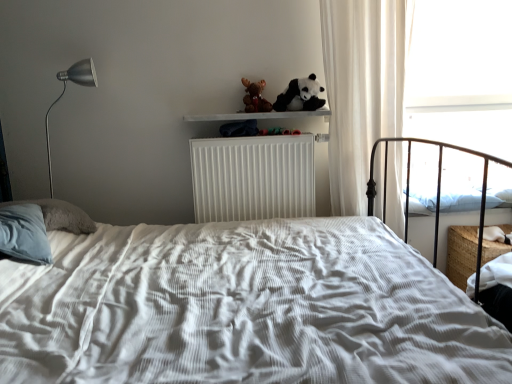
Question: Is white wooden shelf at upper center taller than white sheer curtain at right?

Choices:
 (A) yes
 (B) no

Answer: (B)

Question: From the image's perspective, is white wooden shelf at upper center below white sheer curtain at right?

Choices:
 (A) no
 (B) yes

Answer: (A)

Question: Is white wooden shelf at upper center aimed at white sheer curtain at right?

Choices:
 (A) yes
 (B) no

Answer: (B)

Question: Considering the relative sizes of white wooden shelf at upper center and white sheer curtain at right in the image provided, is white wooden shelf at upper center wider than white sheer curtain at right?

Choices:
 (A) yes
 (B) no

Answer: (B)

Question: Can you confirm if white wooden shelf at upper center is thinner than white sheer curtain at right?

Choices:
 (A) no
 (B) yes

Answer: (B)

Question: Is white sheer curtain at right completely or partially inside white wooden shelf at upper center?

Choices:
 (A) no
 (B) yes

Answer: (A)

Question: From a real-world perspective, is white wooden shelf at upper center below soft plush panda at upper center?

Choices:
 (A) no
 (B) yes

Answer: (B)

Question: Are white wooden shelf at upper center and soft plush panda at upper center making contact?

Choices:
 (A) yes
 (B) no

Answer: (B)

Question: Does white wooden shelf at upper center appear on the left side of soft plush panda at upper center?

Choices:
 (A) yes
 (B) no

Answer: (A)

Question: From a real-world perspective, is white wooden shelf at upper center physically above soft plush panda at upper center?

Choices:
 (A) yes
 (B) no

Answer: (B)

Question: From the image's perspective, is white wooden shelf at upper center over soft plush panda at upper center?

Choices:
 (A) no
 (B) yes

Answer: (A)

Question: Are white wooden shelf at upper center and soft plush panda at upper center located far from each other?

Choices:
 (A) yes
 (B) no

Answer: (B)

Question: Is the depth of transparent glass window at upper right greater than that of soft plush panda at upper center?

Choices:
 (A) no
 (B) yes

Answer: (B)